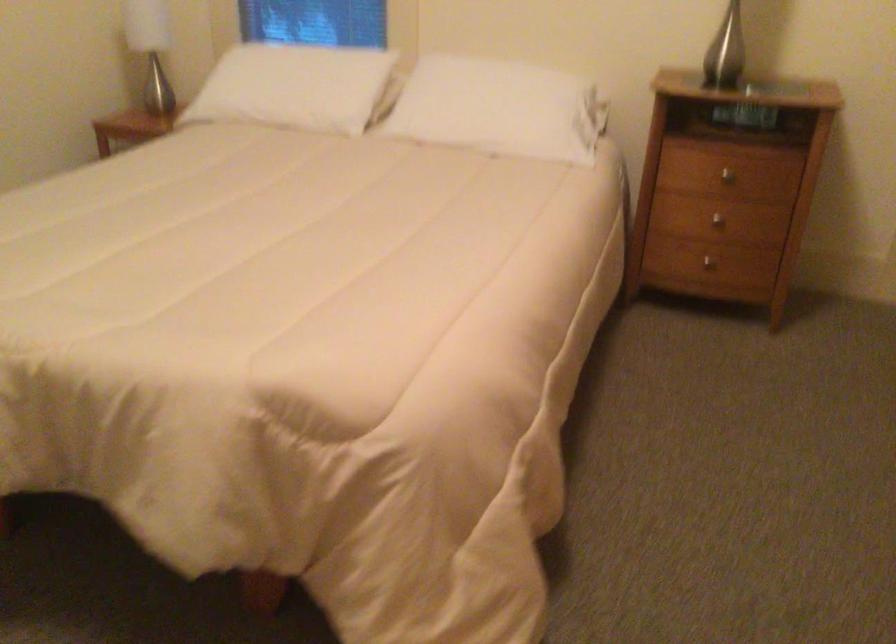
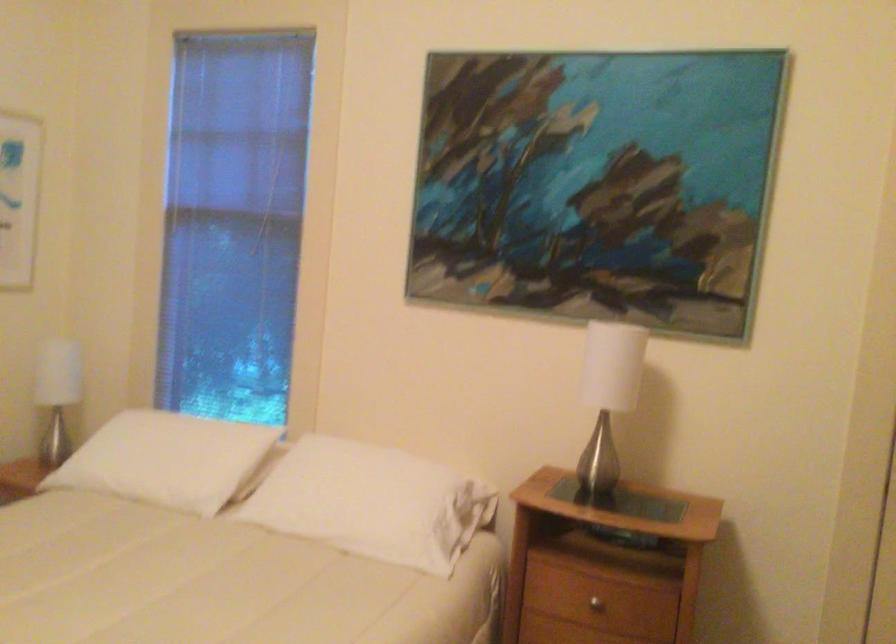
Find the pixel in the second image that matches point 294,84 in the first image.

(167, 459)